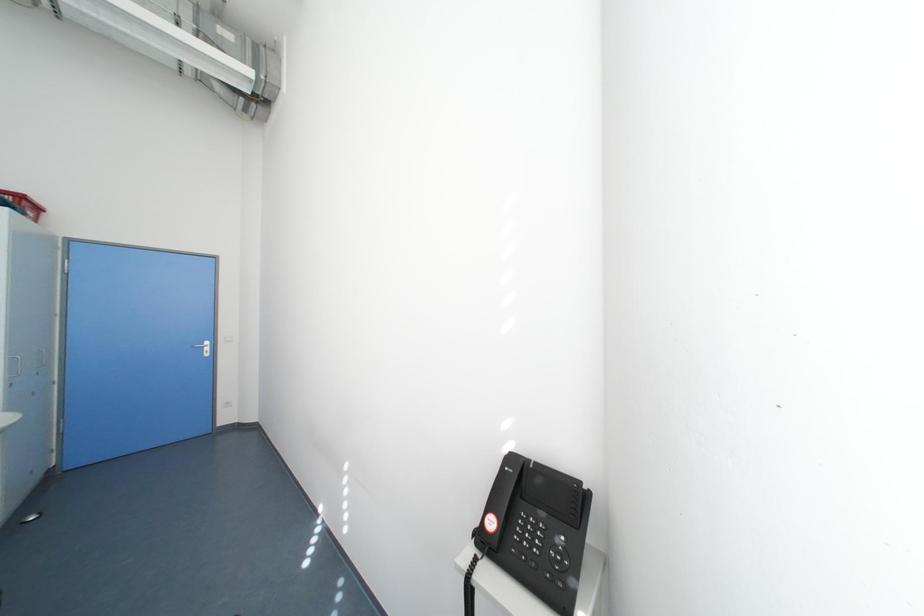
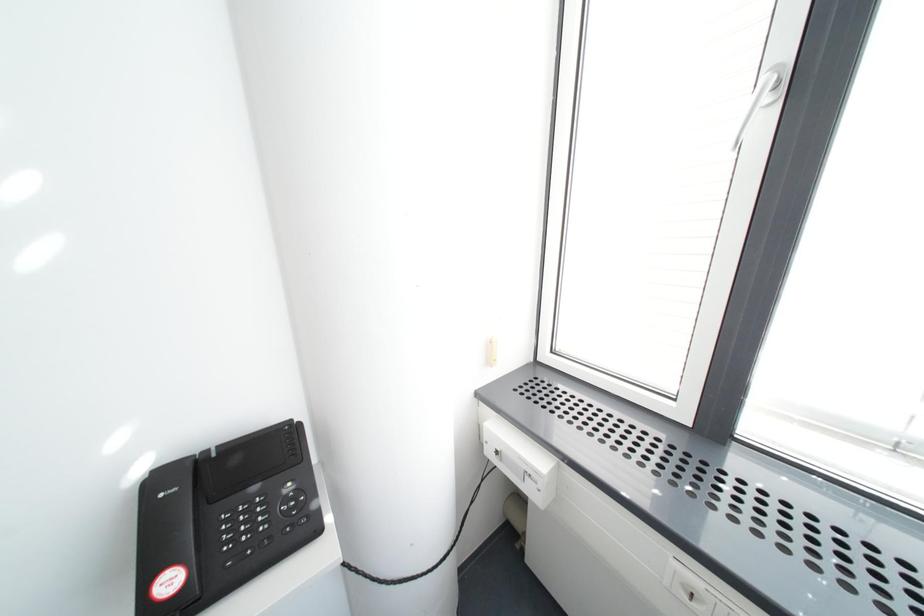
How did the camera likely rotate?

The camera's rotation is toward right-down.